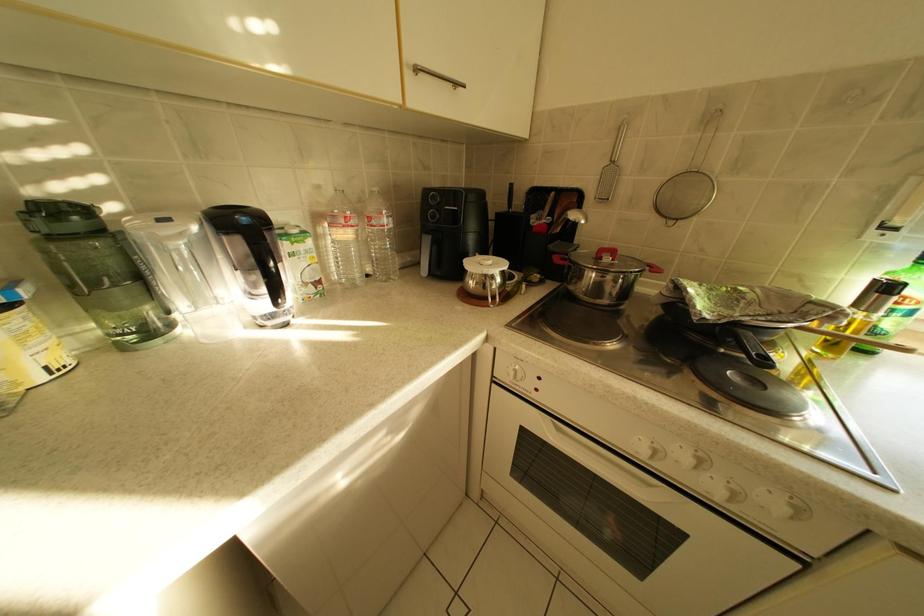
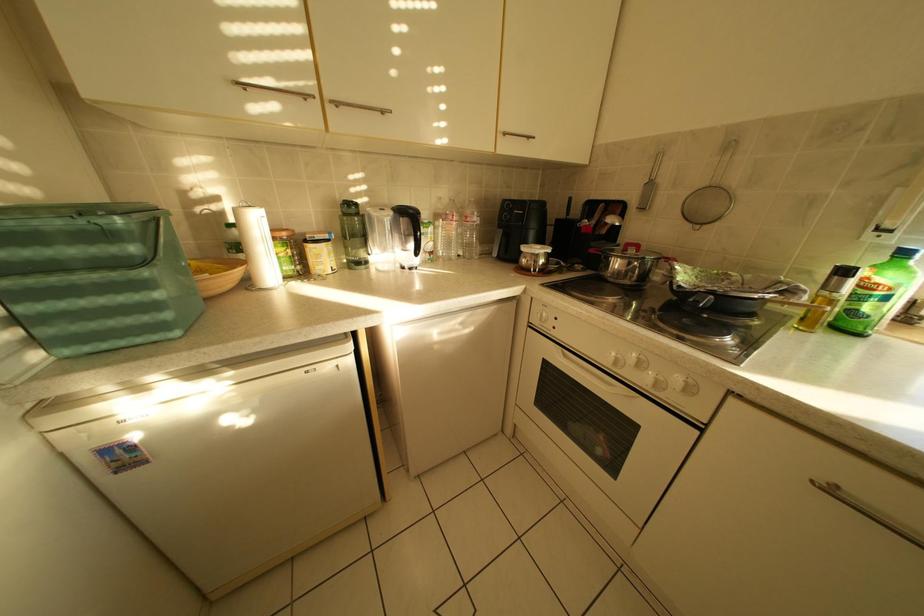
In the scene shown: The images are taken continuously from a first-person perspective. In which direction are you moving?

The cameraman walked toward right, backward.